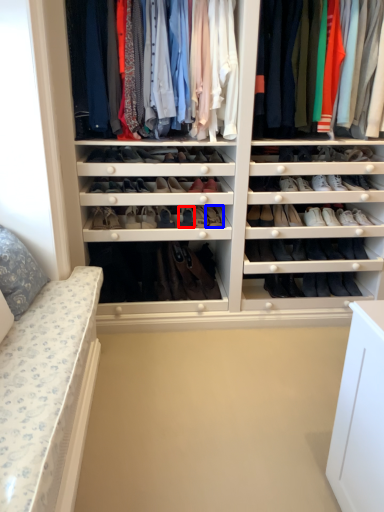
Question: Which object is closer to the camera taking this photo, shoe (highlighted by a red box) or shoe (highlighted by a blue box)?

Choices:
 (A) shoe
 (B) shoe

Answer: (A)